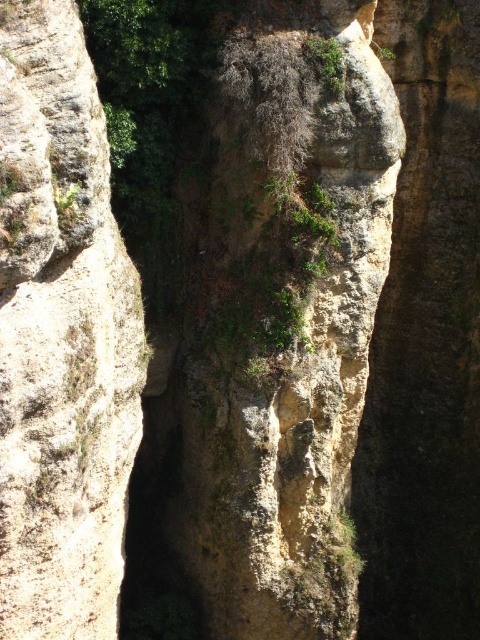
You are a geologist examining the cliff face. You need to determine which object occupies more horizontal space. Which is wider between the rough textured rock at center and the green leafy vegetation at upper center?

The rough textured rock at center is wider than the green leafy vegetation at upper center according to the description.

You are a geologist examining the cliff face. You notice the rough textured rock at center and the green leafy vegetation at upper center. Which object occupies a larger area on the cliff?

The rough textured rock at center is bigger than the green leafy vegetation at upper center, so it occupies a larger area on the cliff.